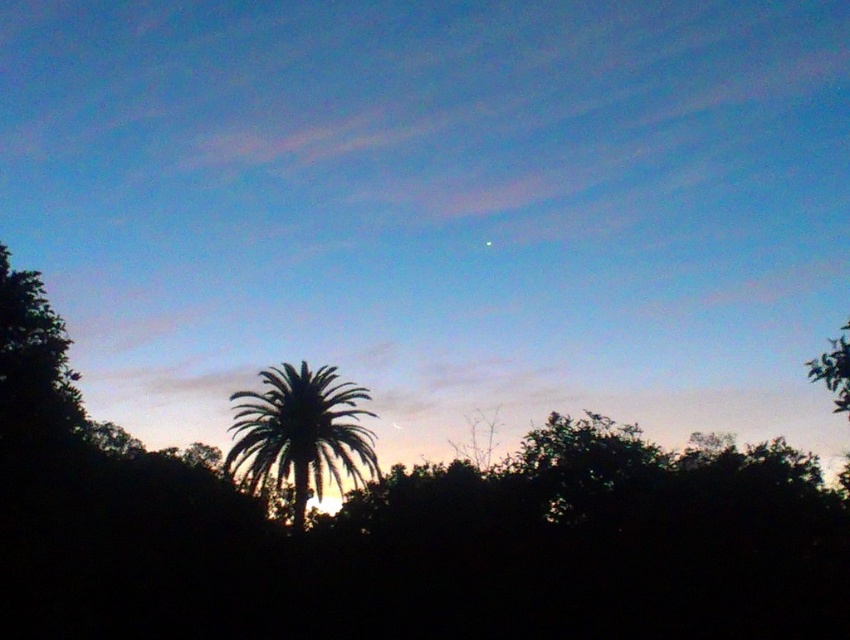
Question: Which point is farther from the camera taking this photo?

Choices:
 (A) (357, 513)
 (B) (316, 438)

Answer: (A)

Question: Can you confirm if silhouette leafy tree at center is wider than silhouette leafy palm at center?

Choices:
 (A) yes
 (B) no

Answer: (A)

Question: Which point appears closest to the camera in this image?

Choices:
 (A) (75, 540)
 (B) (330, 420)

Answer: (A)

Question: Does silhouette leafy tree at center have a greater width compared to silhouette leafy palm at center?

Choices:
 (A) no
 (B) yes

Answer: (B)

Question: Can you confirm if silhouette leafy tree at center is thinner than silhouette leafy palm at center?

Choices:
 (A) yes
 (B) no

Answer: (B)